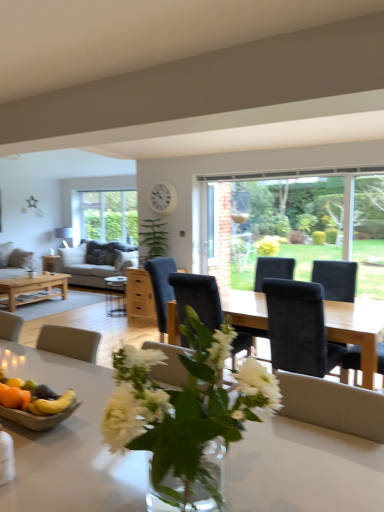
Question: Considering the relative positions of white glossy table at center and suede black chair at center in the image provided, is white glossy table at center in front of suede black chair at center?

Choices:
 (A) no
 (B) yes

Answer: (B)

Question: Considering the relative sizes of white glossy table at center and suede black chair at center in the image provided, is white glossy table at center shorter than suede black chair at center?

Choices:
 (A) no
 (B) yes

Answer: (B)

Question: Does white glossy table at center have a larger size compared to suede black chair at center?

Choices:
 (A) no
 (B) yes

Answer: (A)

Question: From a real-world perspective, is white glossy table at center physically below suede black chair at center?

Choices:
 (A) no
 (B) yes

Answer: (A)

Question: Is white glossy table at center to the right of suede black chair at center from the viewer's perspective?

Choices:
 (A) no
 (B) yes

Answer: (A)

Question: In terms of width, does matte wooden coffee table at center, positioned as the 2th coffee table in left-to-right order, look wider or thinner when compared to suede black chair at center?

Choices:
 (A) wide
 (B) thin

Answer: (B)

Question: From their relative heights in the image, would you say matte wooden coffee table at center, placed as the 1th coffee table when sorted from right to left, is taller or shorter than suede black chair at center?

Choices:
 (A) short
 (B) tall

Answer: (A)

Question: In terms of size, does matte wooden coffee table at center, positioned as the 2th coffee table in left-to-right order, appear bigger or smaller than suede black chair at center?

Choices:
 (A) big
 (B) small

Answer: (B)

Question: Relative to suede black chair at center, is matte wooden coffee table at center, positioned as the 2th coffee table in left-to-right order, in front or behind?

Choices:
 (A) behind
 (B) front

Answer: (A)

Question: Relative to yellow matte bananas at lower left, is matte gray fabric couch at left, which ranks as the 2th studio couch in right-to-left order, in front or behind?

Choices:
 (A) behind
 (B) front

Answer: (A)

Question: From the image's perspective, relative to yellow matte bananas at lower left, is matte gray fabric couch at left, which ranks as the 2th studio couch in right-to-left order, above or below?

Choices:
 (A) above
 (B) below

Answer: (A)

Question: From a real-world perspective, relative to yellow matte bananas at lower left, is matte gray fabric couch at left, which is counted as the first studio couch, starting from the left, vertically above or below?

Choices:
 (A) above
 (B) below

Answer: (B)

Question: Is matte gray fabric couch at left, which ranks as the 2th studio couch in right-to-left order, spatially inside yellow matte bananas at lower left, or outside of it?

Choices:
 (A) outside
 (B) inside

Answer: (A)

Question: In the image, is wooden bowl of fruit at lower left positioned in front of or behind white glossy table at center?

Choices:
 (A) behind
 (B) front

Answer: (A)

Question: In the image, is wooden bowl of fruit at lower left on the left side or the right side of white glossy table at center?

Choices:
 (A) right
 (B) left

Answer: (B)